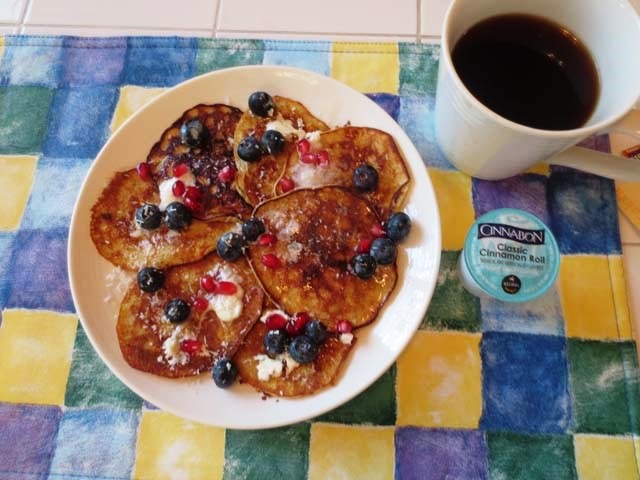
This screenshot has height=480, width=640. I want to click on place mat, so click(x=381, y=77).